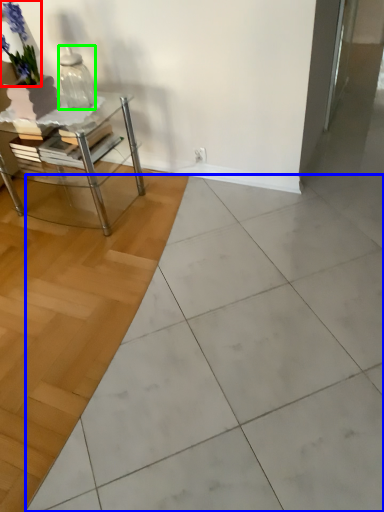
Question: Based on their relative distances, which object is nearer to flower (highlighted by a red box)? Choose from ceramic tile (highlighted by a blue box) and vase (highlighted by a green box).

Choices:
 (A) ceramic tile
 (B) vase

Answer: (B)